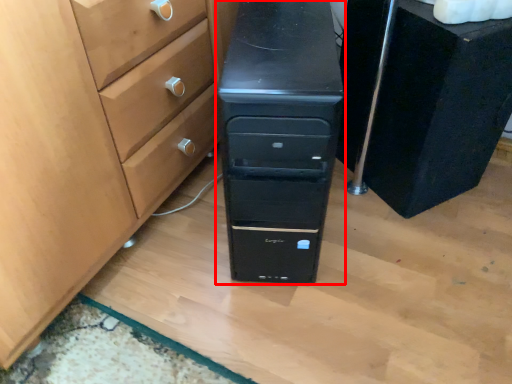
Question: From the image's perspective, where is chest of drawers (annotated by the red box) located in relation to chest of drawers in the image?

Choices:
 (A) below
 (B) above

Answer: (A)